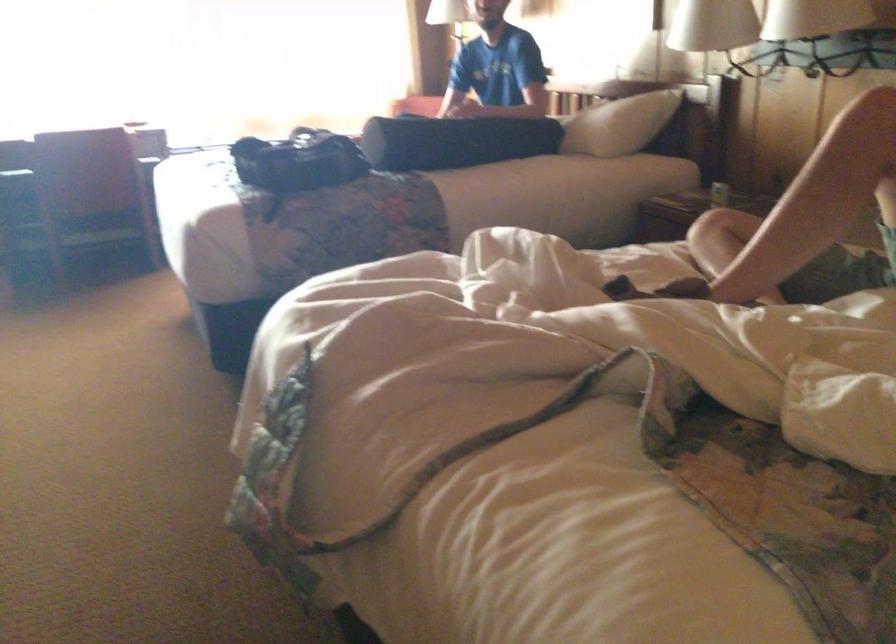
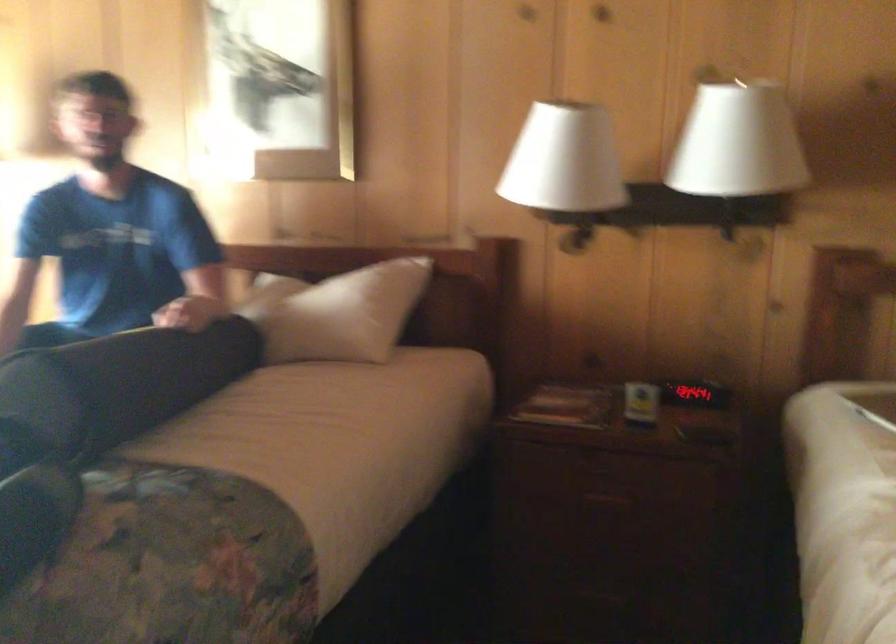
Find the pixel in the second image that matches pixel 364 199 in the first image.

(170, 565)